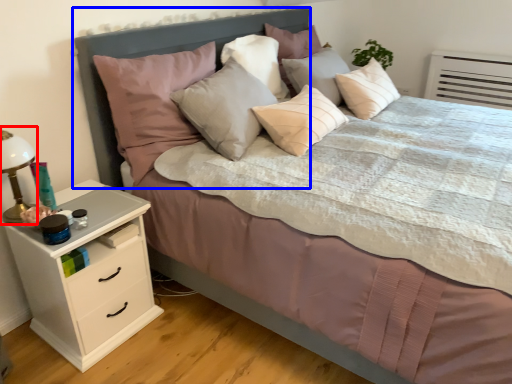
Question: Among these objects, which one is nearest to the camera, bedside lamp (highlighted by a red box) or headboard (highlighted by a blue box)?

Choices:
 (A) bedside lamp
 (B) headboard

Answer: (A)